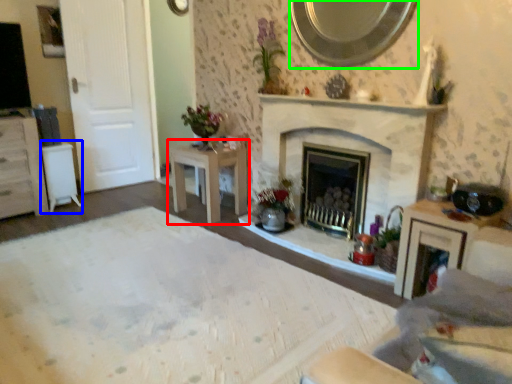
Question: Estimate the real-world distances between objects in this image. Which object is farther from table (highlighted by a red box), table (highlighted by a blue box) or mirror (highlighted by a green box)?

Choices:
 (A) table
 (B) mirror

Answer: (B)